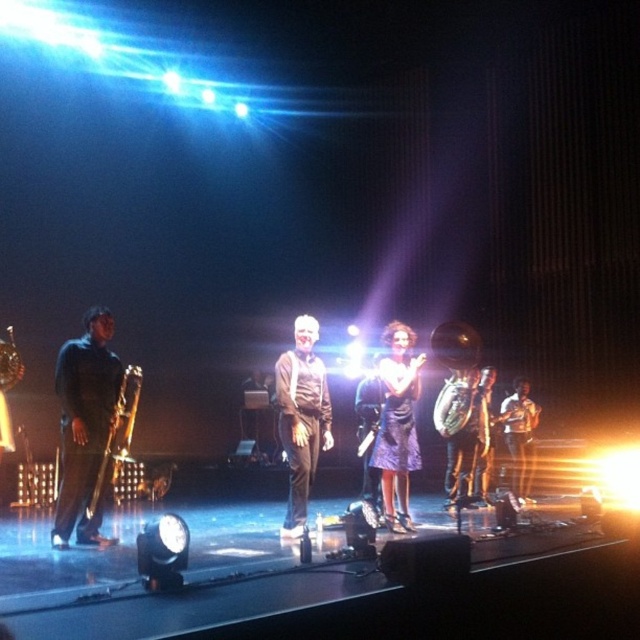
The height and width of the screenshot is (640, 640). Describe the element at coordinates (461, 433) in the screenshot. I see `gold metallic tuba at center` at that location.

Can you confirm if gold metallic tuba at center is taller than matte black trombone at left?

Correct, gold metallic tuba at center is much taller as matte black trombone at left.

Where is `gold metallic tuba at center`? gold metallic tuba at center is located at coordinates (461, 433).

This screenshot has width=640, height=640. In order to click on gold metallic tuba at center in this screenshot , I will do `click(461, 433)`.

Can you confirm if matte black saxophone at left is shorter than shiny purple dress at center?

In fact, matte black saxophone at left may be taller than shiny purple dress at center.

Which is more to the left, matte black saxophone at left or shiny purple dress at center?

matte black saxophone at left

I want to click on matte black saxophone at left, so click(x=84, y=426).

Locate an element on the screen. This screenshot has width=640, height=640. matte black saxophone at left is located at coordinates tap(84, 426).

Is shiny purple dress at center to the left of gold metallic tuba at center from the viewer's perspective?

Yes, shiny purple dress at center is to the left of gold metallic tuba at center.

Identify the location of shiny purple dress at center. (397, 424).